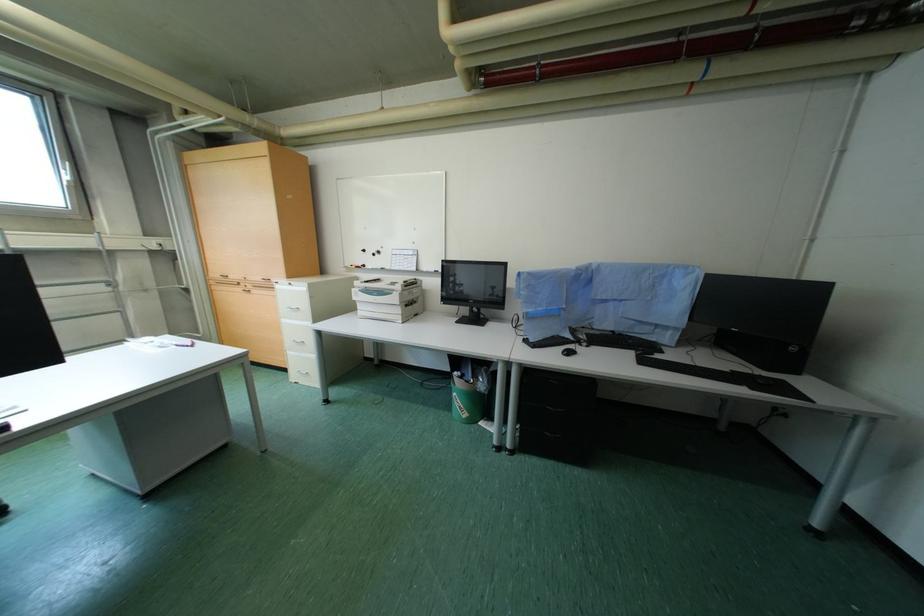
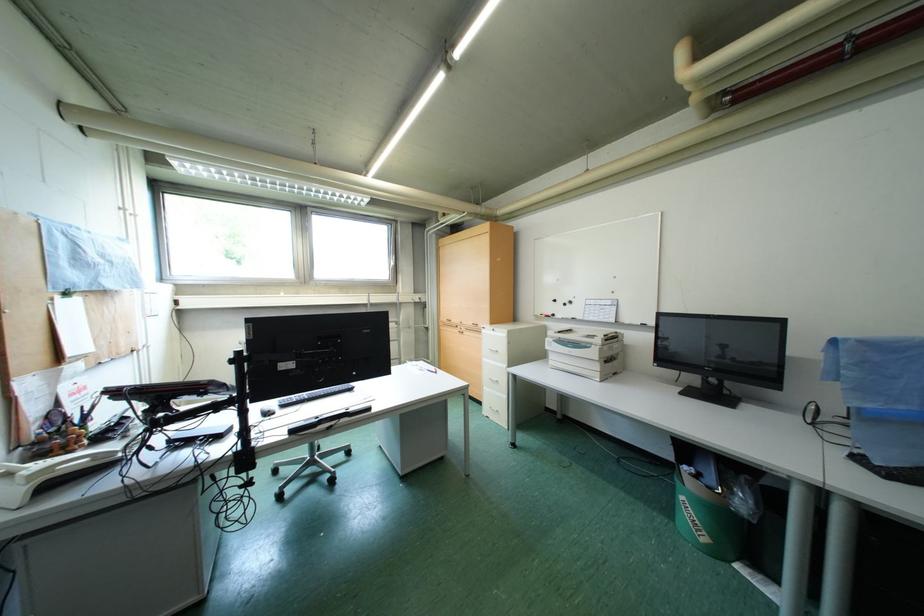
Question: The first image is from the beginning of the video and the second image is from the end. How did the camera likely rotate when shooting the video?

Choices:
 (A) Left
 (B) Right
 (C) Up
 (D) Down

Answer: (A)